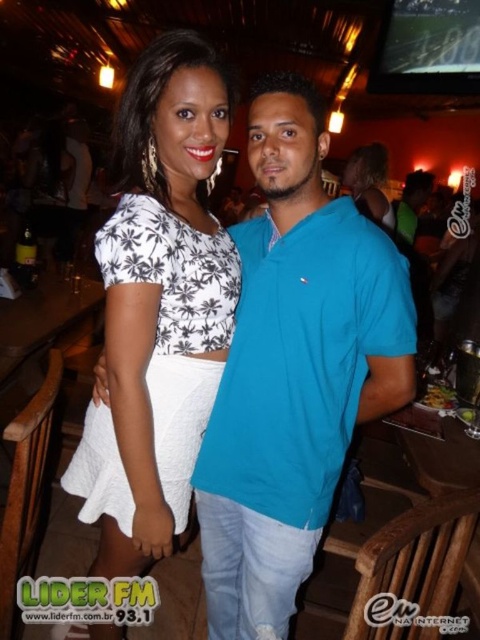
Does white textured skirt at center have a lesser height compared to matte black dress at center?

No, white textured skirt at center is not shorter than matte black dress at center.

Where is `white textured skirt at center`? The image size is (480, 640). white textured skirt at center is located at coordinates (158, 305).

Identify the location of white textured skirt at center. (158, 305).

Consider the image. Between blue cotton shirt at center and matte black dress at center, which one appears on the left side from the viewer's perspective?

blue cotton shirt at center is more to the left.

Does blue cotton shirt at center lie behind matte black dress at center?

No.

The width and height of the screenshot is (480, 640). Find the location of `blue cotton shirt at center`. blue cotton shirt at center is located at coordinates (294, 369).

Image resolution: width=480 pixels, height=640 pixels. I want to click on blue cotton shirt at center, so click(x=294, y=369).

Does blue cotton shirt at center lie behind white textured skirt at center?

Yes.

Between blue cotton shirt at center and white textured skirt at center, which one has less height?

white textured skirt at center

Find the location of a particular element. blue cotton shirt at center is located at coordinates (294, 369).